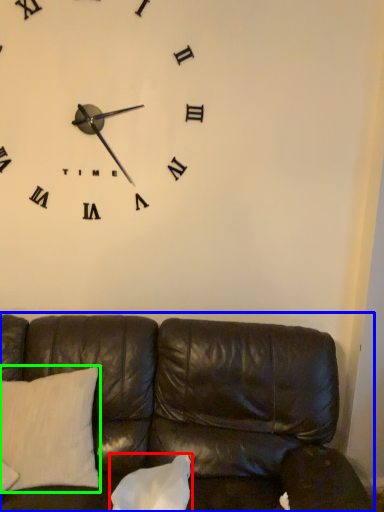
Question: Based on their relative distances, which object is farther from pillow (highlighted by a red box)? Choose from studio couch (highlighted by a blue box) and pillow (highlighted by a green box).

Choices:
 (A) studio couch
 (B) pillow

Answer: (B)